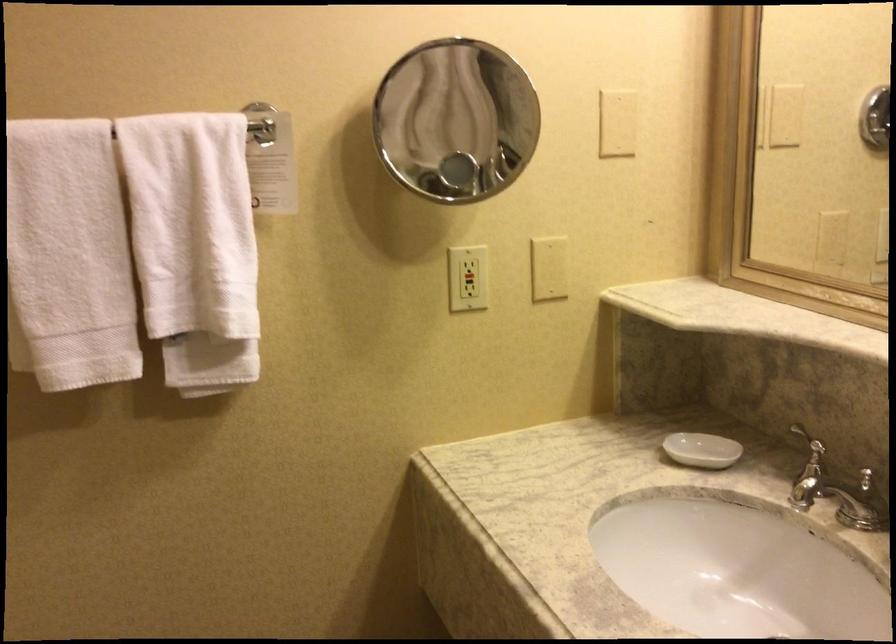
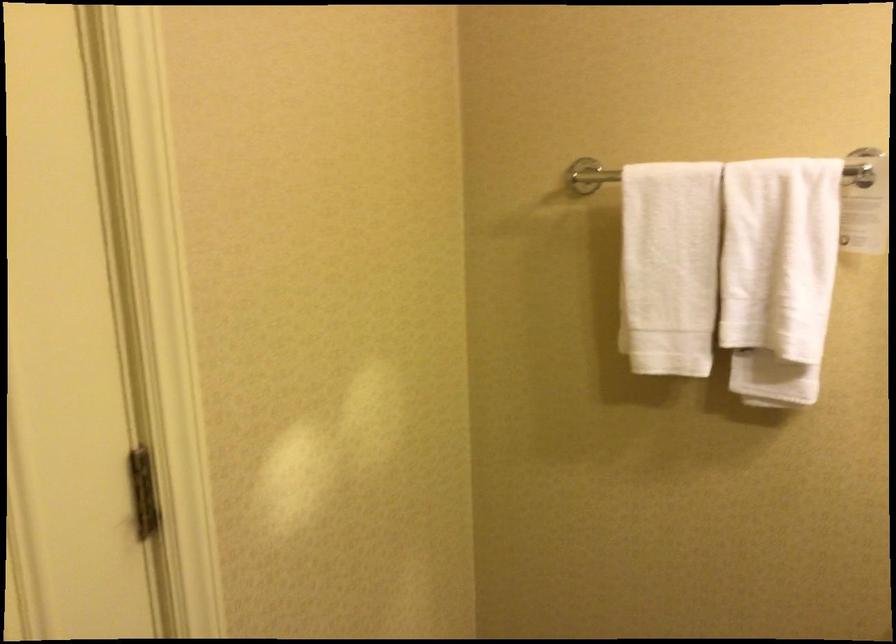
Question: The camera is either moving clockwise (left) or counter-clockwise (right) around the object. The first image is from the beginning of the video and the second image is from the end. Is the camera moving left or right when shooting the video?

Choices:
 (A) Left
 (B) Right

Answer: (B)